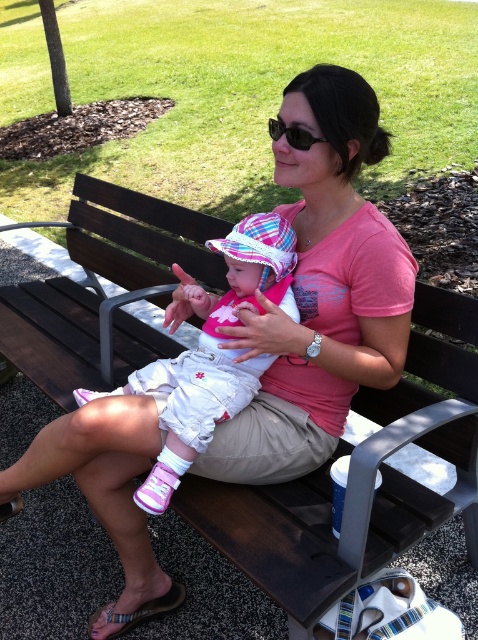
Question: Is pink fabric baby at center wider than black plastic sunglasses at center?

Choices:
 (A) no
 (B) yes

Answer: (B)

Question: Which point is farther to the camera?

Choices:
 (A) (275, 241)
 (B) (379, 388)

Answer: (B)

Question: Which point is closer to the camera taking this photo?

Choices:
 (A) (369, 556)
 (B) (227, 384)

Answer: (A)

Question: Which point is closer to the camera taking this photo?

Choices:
 (A) (290, 611)
 (B) (289, 138)
 (C) (240, 371)

Answer: (A)

Question: From the image, what is the correct spatial relationship of brown wooden bench at center in relation to black plastic sunglasses at center?

Choices:
 (A) left
 (B) right

Answer: (A)

Question: Is brown wooden bench at center in front of pink fabric baby at center?

Choices:
 (A) no
 (B) yes

Answer: (A)